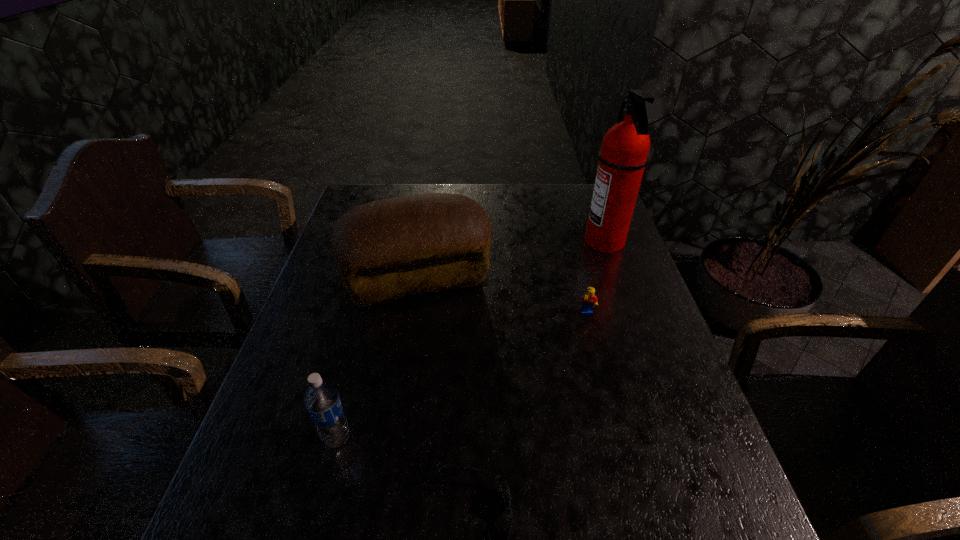
Locate an element on the screen. Image resolution: width=960 pixels, height=540 pixels. vacant region located on the right of the fourth shortest object is located at coordinates (564, 278).

Locate an element on the screen. Image resolution: width=960 pixels, height=540 pixels. blank space located 0.180m on the right of the water bottle is located at coordinates (441, 438).

The height and width of the screenshot is (540, 960). What are the coordinates of `vacant space located 0.310m on the face of the second object from right to left` in the screenshot? It's located at (616, 429).

Find the location of a particular element. The image size is (960, 540). bread situated at the left edge is located at coordinates (387, 249).

The width and height of the screenshot is (960, 540). What are the coordinates of `water bottle that is at the left edge` in the screenshot? It's located at (322, 401).

The image size is (960, 540). In order to click on fire extinguisher present at the right edge in this screenshot , I will do `click(624, 154)`.

Identify the location of Lego located in the right edge section of the desktop. (589, 300).

In the image, there is a desktop. Identify the location of vacant region at the far edge. Image resolution: width=960 pixels, height=540 pixels. (562, 213).

Identify the location of free space at the left edge of the desktop. The width and height of the screenshot is (960, 540). (341, 395).

Find the location of a particular element. Image resolution: width=960 pixels, height=540 pixels. vacant space at the right edge is located at coordinates (631, 289).